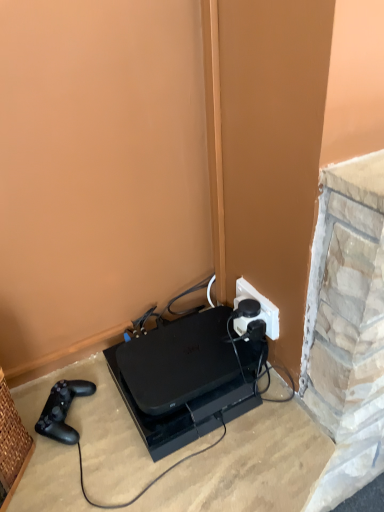
I want to click on vacant region to the left of black plastic gaming console at lower center, so click(x=84, y=430).